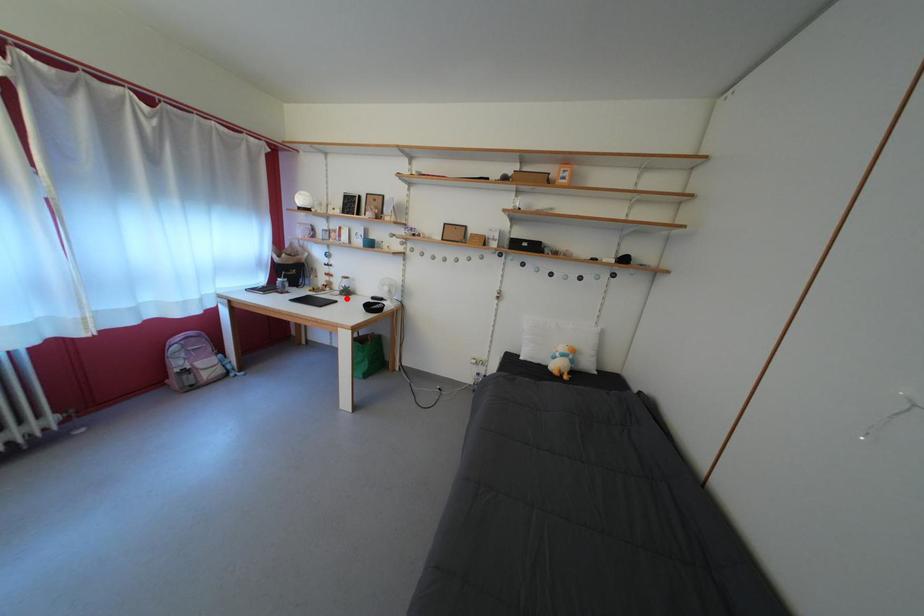
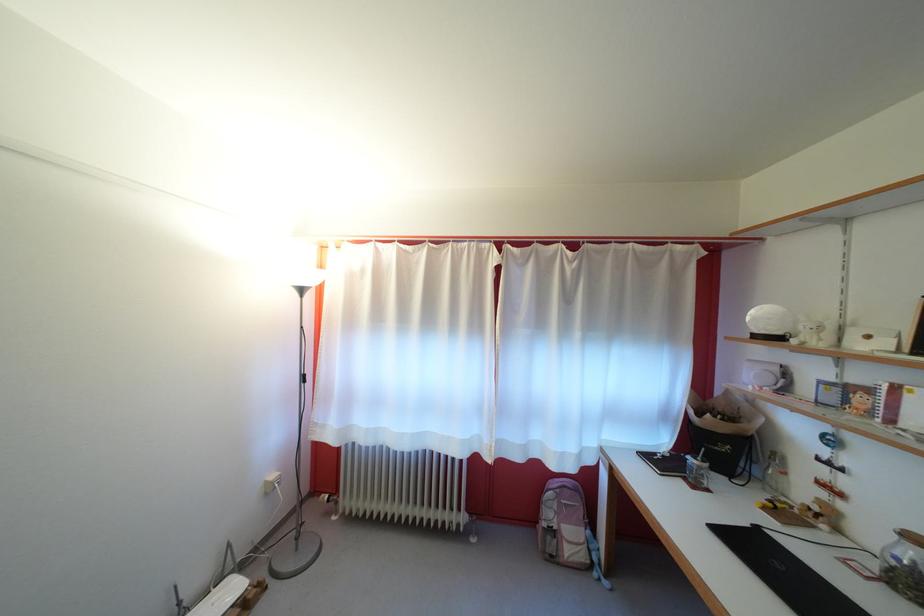
Find the pixel in the second image that matches the highlighted location in the first image.

(881, 570)